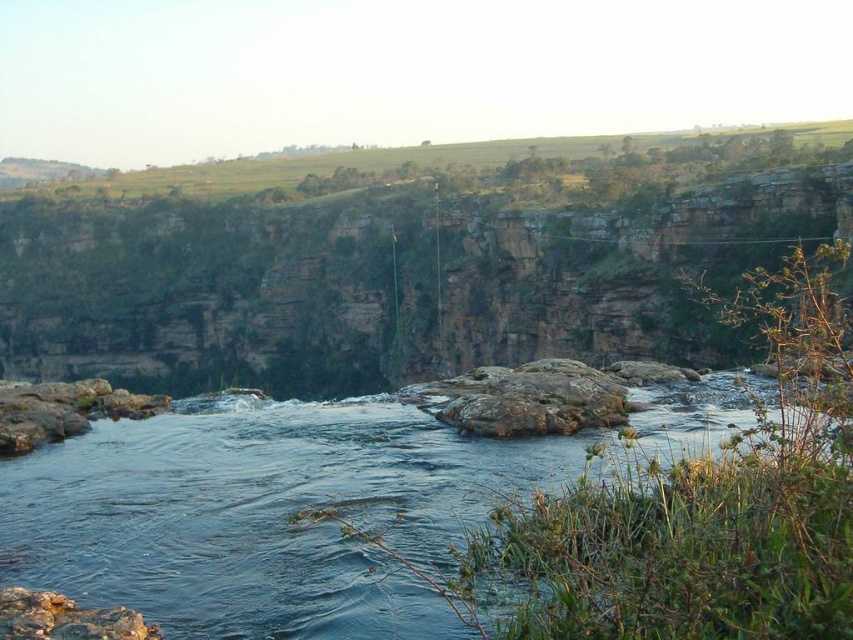
Question: Which object is positioned closest to the smooth gray rock at lower left?

Choices:
 (A) rusty stone at lower left
 (B) clear water at center
 (C) green grassy hillside at upper center

Answer: (B)

Question: Does clear water at center have a smaller size compared to smooth gray rock at lower left?

Choices:
 (A) no
 (B) yes

Answer: (B)

Question: Estimate the real-world distances between objects in this image. Which object is closer to the green grassy hillside at upper center?

Choices:
 (A) clear water at center
 (B) smooth gray rock at lower left
 (C) rusty stone at lower left

Answer: (B)

Question: Observing the image, what is the correct spatial positioning of green grassy hillside at upper center in reference to clear water at center?

Choices:
 (A) left
 (B) right

Answer: (B)

Question: Which object is farther from the camera taking this photo?

Choices:
 (A) clear water at center
 (B) smooth gray rock at lower left
 (C) rusty stone at lower left

Answer: (B)

Question: Does green grassy hillside at upper center have a larger size compared to rusty stone at lower left?

Choices:
 (A) no
 (B) yes

Answer: (B)